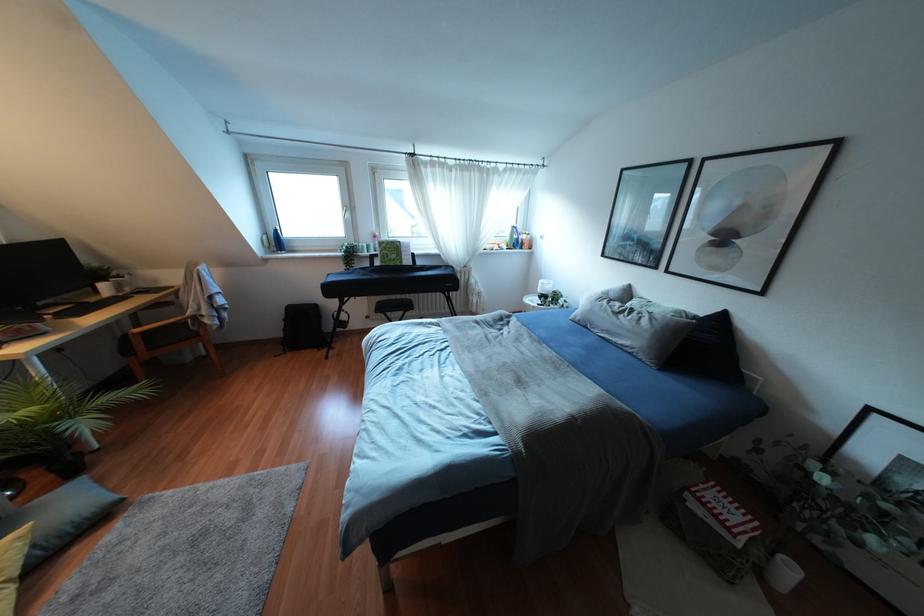
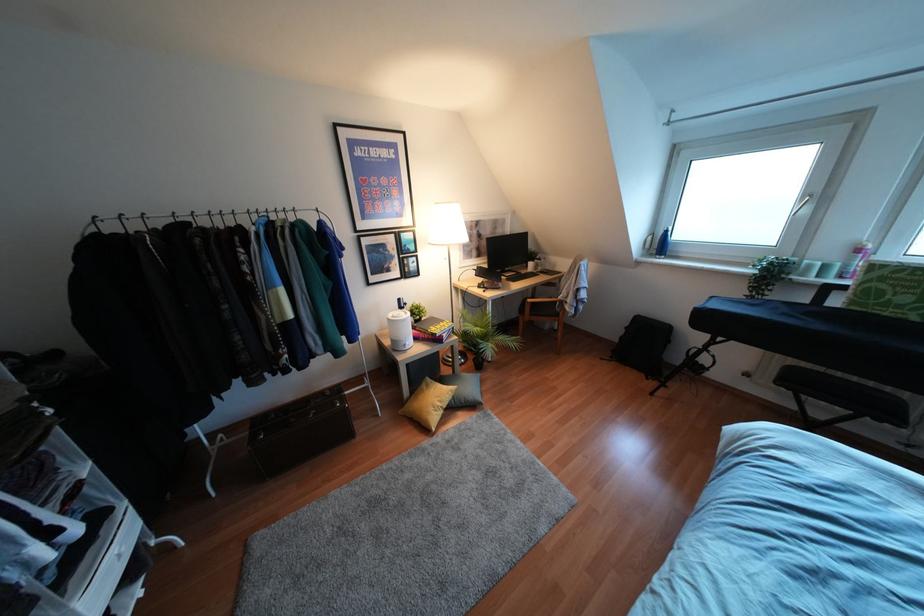
The point at (373, 236) is marked in the first image. Where is the corresponding point in the second image?

(858, 249)